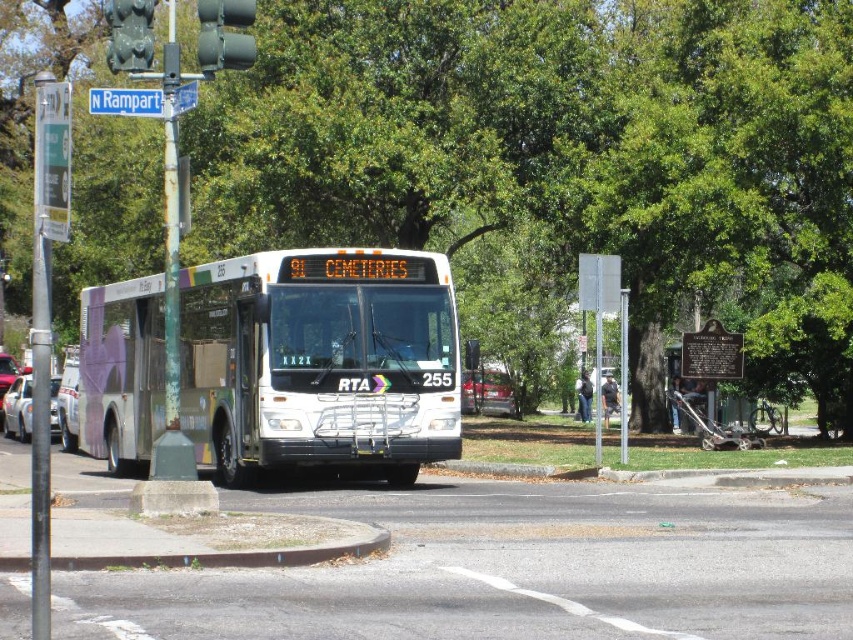
Question: Is green leafy tree at center below metallic silver car at left?

Choices:
 (A) no
 (B) yes

Answer: (A)

Question: Can you confirm if metallic silver sedan at center is positioned to the left of metallic silver car at center?

Choices:
 (A) no
 (B) yes

Answer: (B)

Question: Can you confirm if brown wooden sign at center is positioned to the right of white glossy sedan at left?

Choices:
 (A) no
 (B) yes

Answer: (B)

Question: Considering the real-world distances, which object is farthest from the green leafy tree at center?

Choices:
 (A) white matte bus at center
 (B) metallic silver car at left

Answer: (B)

Question: Which point is closer to the camera taking this photo?

Choices:
 (A) (350, 164)
 (B) (96, 435)
 (C) (599, 381)
 (D) (141, 8)

Answer: (D)

Question: Which is farther from the metallic silver car at center?

Choices:
 (A) green leafy tree at center
 (B) metallic silver car at left

Answer: (B)